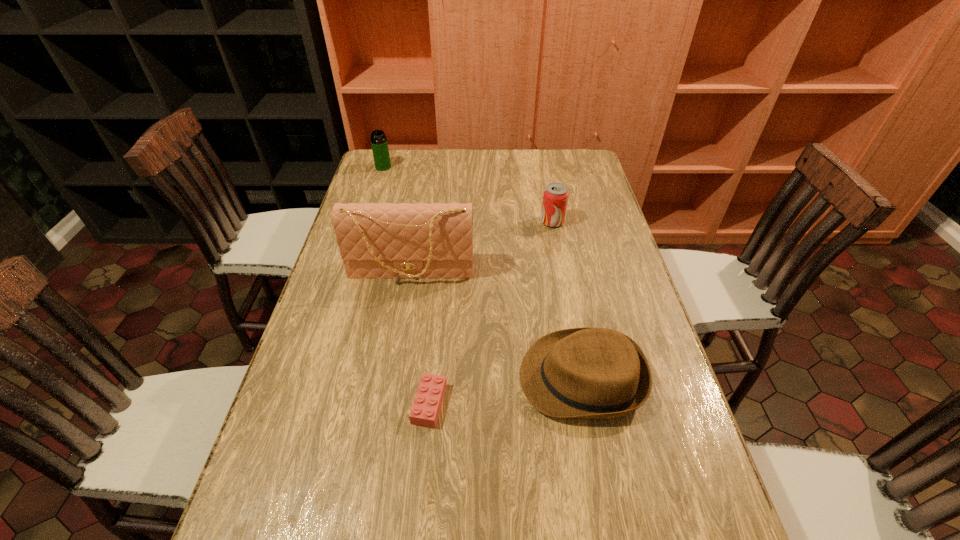
You are a GUI agent. You are given a task and a screenshot of the screen. Output one action in this format:
    pyautogui.click(x=<x>, y=<y>)
    Task: Click on the free space located on the back of the second farthest object
    Image resolution: width=960 pixels, height=540 pixels.
    Given the screenshot: What is the action you would take?
    pyautogui.click(x=549, y=204)

Image resolution: width=960 pixels, height=540 pixels. Find the location of `vacant space located on the front-facing side of the fedora`. vacant space located on the front-facing side of the fedora is located at coordinates (410, 379).

Locate an element on the screen. The width and height of the screenshot is (960, 540). free space located 0.330m on the front-facing side of the fedora is located at coordinates (375, 379).

I want to click on free space located 0.080m on the front-facing side of the fedora, so click(x=485, y=379).

Locate an element on the screen. free space located 0.260m on the right of the Lego is located at coordinates (565, 403).

This screenshot has height=540, width=960. Find the location of `object that is positioned at the far edge`. object that is positioned at the far edge is located at coordinates (379, 144).

I want to click on handbag located at the left edge, so click(376, 241).

The image size is (960, 540). I want to click on thermos bottle that is at the left edge, so click(x=379, y=144).

Locate an element on the screen. Image resolution: width=960 pixels, height=540 pixels. soda can positioned at the right edge is located at coordinates (555, 197).

Locate an element on the screen. Image resolution: width=960 pixels, height=540 pixels. fedora positioned at the right edge is located at coordinates (601, 373).